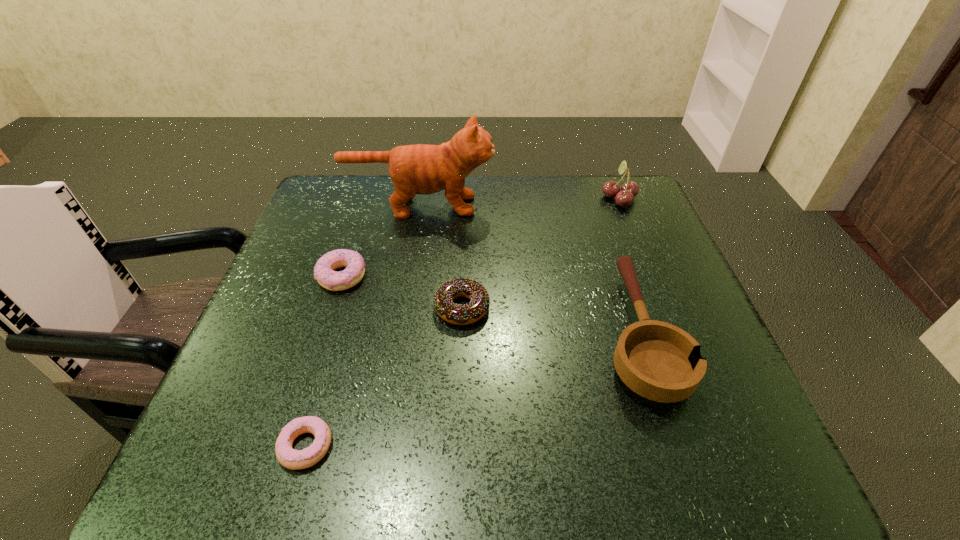
This screenshot has height=540, width=960. Identify the location of free spot between the tallest object and the second tallest object. (519, 202).

Where is `unoccupied position between the cat and the saucepan`? unoccupied position between the cat and the saucepan is located at coordinates (529, 269).

Image resolution: width=960 pixels, height=540 pixels. I want to click on vacant point located between the rightmost doughnut and the nearest doughnut, so click(384, 377).

At what (x,y) coordinates should I click in order to perform the action: click on vacant area that lies between the rightmost doughnut and the nearest doughnut. Please return your answer as a coordinate pair (x, y). This screenshot has height=540, width=960. Looking at the image, I should click on (384, 377).

Find the location of a particular element. unoccupied position between the saucepan and the nearest object is located at coordinates (471, 390).

Find the location of a particular element. This screenshot has height=540, width=960. vacant area that lies between the shortest object and the rightmost doughnut is located at coordinates (384, 377).

Identify the location of empty space between the tallest object and the second tallest object. This screenshot has width=960, height=540. (519, 202).

This screenshot has height=540, width=960. I want to click on vacant space that is in between the tallest object and the saucepan, so click(x=529, y=269).

Identify which object is the fourth closest to the tallest object. Please provide its 2D coordinates. Your answer should be formatted as a tuple, i.e. [(x, y)], where the tuple contains the x and y coordinates of a point satisfying the conditions above.

[(624, 197)]

The height and width of the screenshot is (540, 960). I want to click on object that stands as the fifth closest to the second tallest object, so click(288, 457).